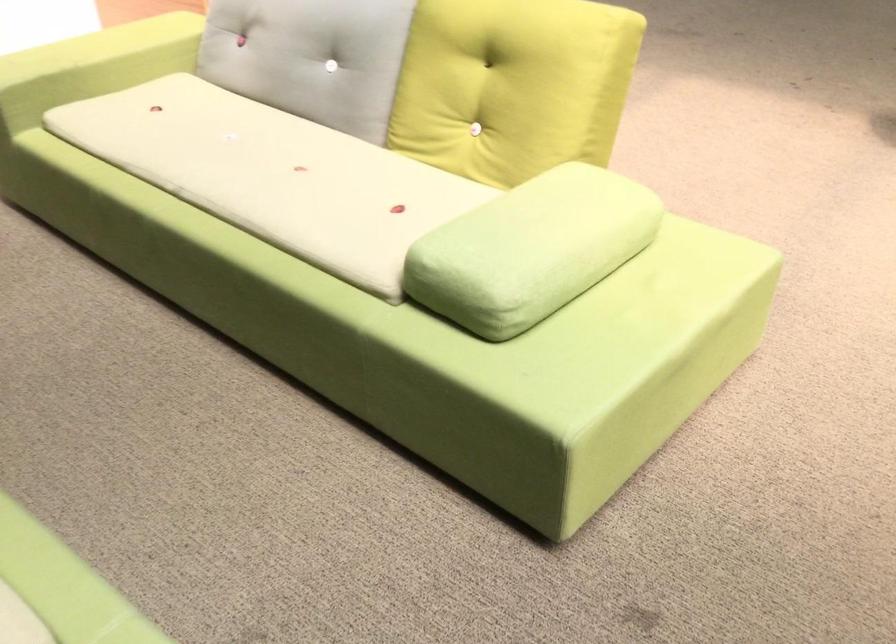
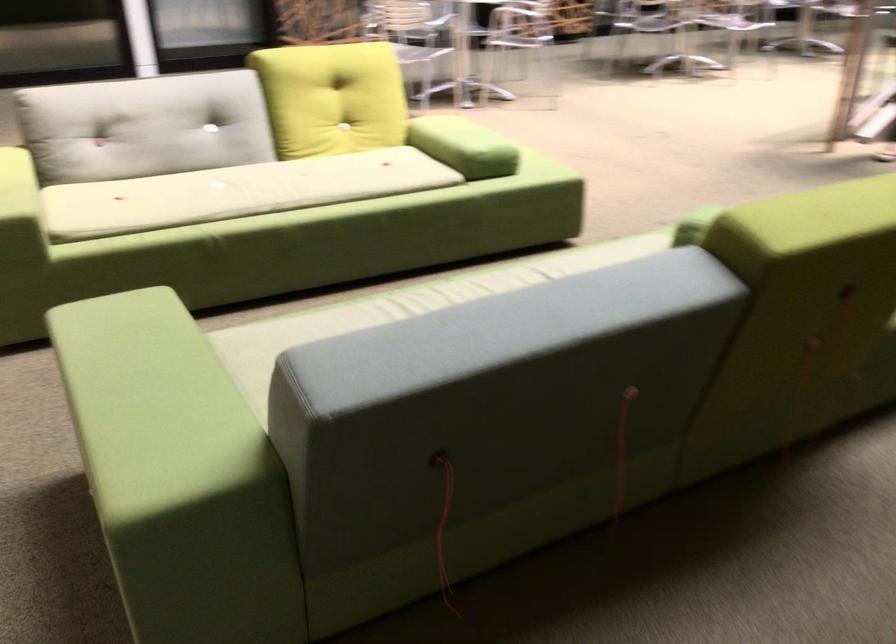
Locate, in the second image, the point that corresponds to the point at 194,152 in the first image.

(236, 192)